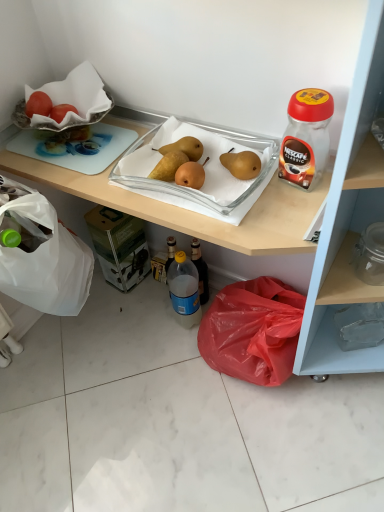
Question: Based on their positions, is smooth red tomato at upper left located to the left or right of matte plastic cabinet at lower right?

Choices:
 (A) left
 (B) right

Answer: (A)

Question: From their relative heights in the image, would you say smooth red tomato at upper left is taller or shorter than matte plastic cabinet at lower right?

Choices:
 (A) short
 (B) tall

Answer: (A)

Question: Which object is the closest to the smooth red tomato at upper left?

Choices:
 (A) yellow matte pears at center
 (B) matte plastic cabinet at lower right
 (C) blue translucent bottle at center, the 2th bottle positioned from the top
 (D) transparent plastic jar at upper right, marked as the first bottle in a right-to-left arrangement

Answer: (A)

Question: Estimate the real-world distances between objects in this image. Which object is farther from the transparent plastic jar at upper right, arranged as the second bottle when ordered from the bottom?

Choices:
 (A) blue translucent bottle at center, which is the first bottle from bottom to top
 (B) yellow matte pears at center
 (C) matte plastic cabinet at lower right
 (D) smooth red tomato at upper left

Answer: (D)